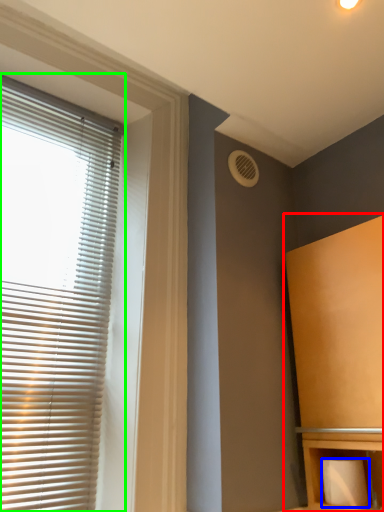
Question: Considering the real-world distances, which object is closest to furniture (highlighted by a red box)? toilet paper (highlighted by a blue box) or window blind (highlighted by a green box).

Choices:
 (A) toilet paper
 (B) window blind

Answer: (A)